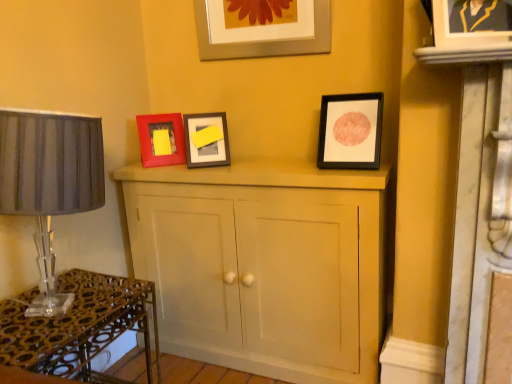
Locate an element on the screen. vacant space underneath matte gray lampshade at left (from a real-world perspective) is located at coordinates (50, 306).